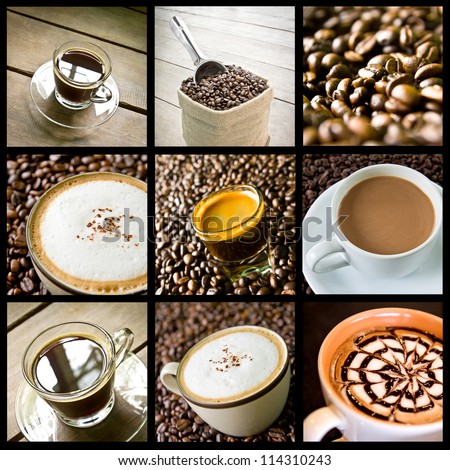
Image resolution: width=450 pixels, height=470 pixels. I want to click on cups with handles, so click(x=169, y=371), click(x=123, y=341), click(x=106, y=92), click(x=328, y=248), click(x=324, y=421).